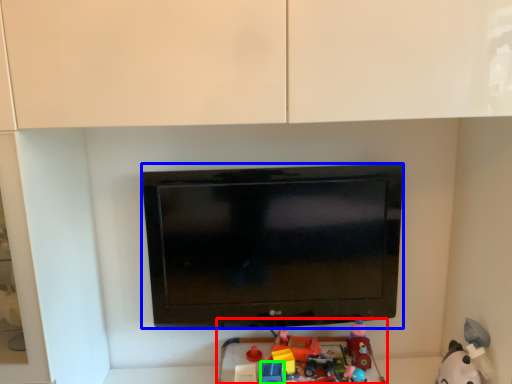
Question: Considering the real-world distances, which object is farthest from toy (highlighted by a red box)? television (highlighted by a blue box) or toy (highlighted by a green box)?

Choices:
 (A) television
 (B) toy

Answer: (A)